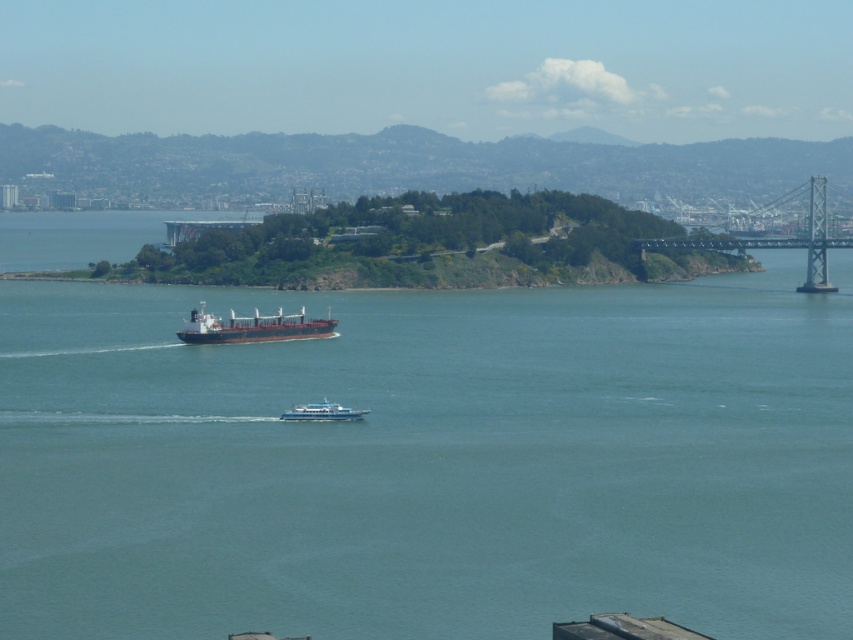
Question: Is greenish-blue water at center in front of white glossy boat at center?

Choices:
 (A) no
 (B) yes

Answer: (B)

Question: Considering the real-world distances, which object is closest to the brown matte cargo ship at center?

Choices:
 (A) white glossy boat at center
 (B) greenish-blue water at center
 (C) metallic gray suspension bridge at right

Answer: (A)

Question: Does brown matte cargo ship at center lie in front of white glossy boat at center?

Choices:
 (A) yes
 (B) no

Answer: (B)

Question: Considering the relative positions of metallic gray suspension bridge at right and brown matte cargo ship at center in the image provided, where is metallic gray suspension bridge at right located with respect to brown matte cargo ship at center?

Choices:
 (A) below
 (B) above

Answer: (B)

Question: Which point is farther to the camera?

Choices:
 (A) brown matte cargo ship at center
 (B) white glossy boat at center
 (C) metallic gray suspension bridge at right

Answer: (C)

Question: Among these objects, which one is nearest to the camera?

Choices:
 (A) white glossy boat at center
 (B) metallic gray suspension bridge at right

Answer: (A)